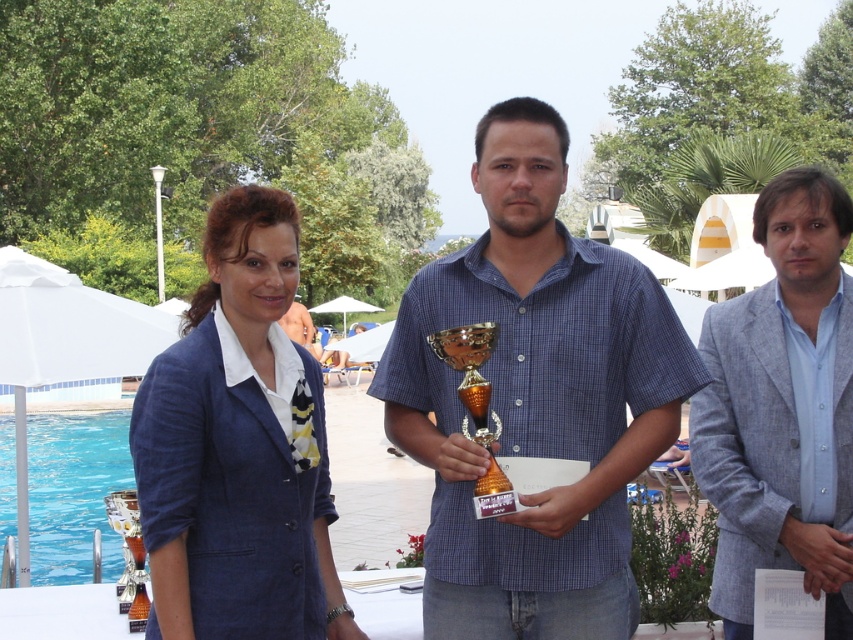
You are a photographer at a poolside event. You need to capture a photo of the blue linen suit at center without the blue glass pool at lower left being visible in the background. Is this possible based on their positions?

The blue linen suit at center is in front of the blue glass pool at lower left, so if you position yourself so that the suit blocks the view of the pool, it would not be visible in the background.

You are a photographer at this poolside event and need to capture a photo of the gray textured blazer at right and blue glass pool at lower left. Which object should you focus on first if you want to ensure both are in the frame without moving the camera?

The gray textured blazer at right is much taller than the blue glass pool at lower left, so you should focus on the taller object first to ensure it fits within the frame.

You are standing at the poolside and see two points marked in the image. Which point is closer to you, point (792, 323) or point (67, 442)?

Point (792, 323) is closer to the viewer than point (67, 442).